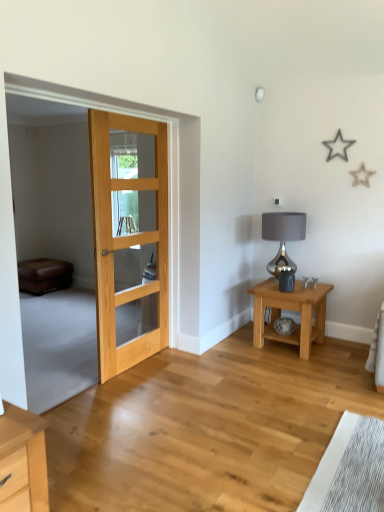
Question: From the image's perspective, does natural wood door at left appear higher than brown leather couch at left?

Choices:
 (A) yes
 (B) no

Answer: (A)

Question: Is natural wood door at left turned away from brown leather couch at left?

Choices:
 (A) no
 (B) yes

Answer: (A)

Question: Is natural wood door at left to the right of brown leather couch at left from the viewer's perspective?

Choices:
 (A) no
 (B) yes

Answer: (B)

Question: Does natural wood door at left have a lesser width compared to brown leather couch at left?

Choices:
 (A) yes
 (B) no

Answer: (A)

Question: From a real-world perspective, is natural wood door at left physically below brown leather couch at left?

Choices:
 (A) no
 (B) yes

Answer: (A)

Question: From the image's perspective, is natural wood door at left positioned above or below brown leather couch at left?

Choices:
 (A) above
 (B) below

Answer: (A)

Question: Is point (147, 256) closer or farther from the camera than point (21, 269)?

Choices:
 (A) farther
 (B) closer

Answer: (B)

Question: Looking at the image, does natural wood door at left seem bigger or smaller compared to brown leather couch at left?

Choices:
 (A) big
 (B) small

Answer: (A)

Question: From a real-world perspective, is natural wood door at left positioned above or below brown leather couch at left?

Choices:
 (A) above
 (B) below

Answer: (A)

Question: Looking at their shapes, would you say shiny metallic lamp at right is wider or thinner than natural wood door at left?

Choices:
 (A) wide
 (B) thin

Answer: (A)

Question: From the image's perspective, is shiny metallic lamp at right located above or below natural wood door at left?

Choices:
 (A) below
 (B) above

Answer: (A)

Question: Is point (289, 216) positioned closer to the camera than point (102, 121)?

Choices:
 (A) closer
 (B) farther

Answer: (B)

Question: Is shiny metallic lamp at right inside the boundaries of natural wood door at left, or outside?

Choices:
 (A) inside
 (B) outside

Answer: (B)

Question: Is light brown wood nightstand at lower right taller or shorter than shiny metallic lamp at right?

Choices:
 (A) tall
 (B) short

Answer: (B)

Question: Based on their positions, is light brown wood nightstand at lower right located to the left or right of shiny metallic lamp at right?

Choices:
 (A) left
 (B) right

Answer: (B)